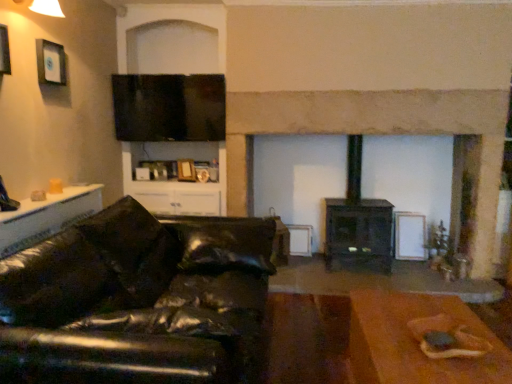
Question: Are black leather couch at left and white glossy table at left, which is the second table from right to left, beside each other?

Choices:
 (A) no
 (B) yes

Answer: (A)

Question: Does black leather couch at left have a lesser height compared to white glossy table at left, the first table from the left?

Choices:
 (A) no
 (B) yes

Answer: (A)

Question: Does black leather couch at left lie behind white glossy table at left, positioned as the 2th table in bottom-to-top order?

Choices:
 (A) no
 (B) yes

Answer: (A)

Question: Can you confirm if black leather couch at left is thinner than white glossy table at left, positioned as the 2th table in bottom-to-top order?

Choices:
 (A) no
 (B) yes

Answer: (A)

Question: Is black leather couch at left to the left of white glossy table at left, which is the second table from right to left, from the viewer's perspective?

Choices:
 (A) yes
 (B) no

Answer: (B)

Question: Does black leather couch at left appear on the right side of white glossy table at left, the first table from the left?

Choices:
 (A) yes
 (B) no

Answer: (A)

Question: Is white glossy table at left, the first table when ordered from top to bottom, positioned with its back to brown wooden table at lower right, arranged as the first table when viewed from the right?

Choices:
 (A) yes
 (B) no

Answer: (B)

Question: Would you consider white glossy table at left, the first table when ordered from top to bottom, to be distant from brown wooden table at lower right, which is the first table from bottom to top?

Choices:
 (A) no
 (B) yes

Answer: (B)

Question: Is white glossy table at left, the first table from the left, further to camera compared to brown wooden table at lower right, the second table viewed from the left?

Choices:
 (A) no
 (B) yes

Answer: (B)

Question: Is white glossy table at left, the first table when ordered from top to bottom, to the right of brown wooden table at lower right, which is the first table from bottom to top, from the viewer's perspective?

Choices:
 (A) yes
 (B) no

Answer: (B)

Question: Is white glossy table at left, the first table when ordered from top to bottom, to the left of brown wooden table at lower right, marked as the second table in a top-to-bottom arrangement, from the viewer's perspective?

Choices:
 (A) no
 (B) yes

Answer: (B)

Question: From a real-world perspective, is white glossy table at left, which is the second table from right to left, located higher than brown wooden table at lower right, which is the first table from bottom to top?

Choices:
 (A) yes
 (B) no

Answer: (A)

Question: Is flat matte screen at upper center oriented towards black leather couch at left?

Choices:
 (A) no
 (B) yes

Answer: (A)